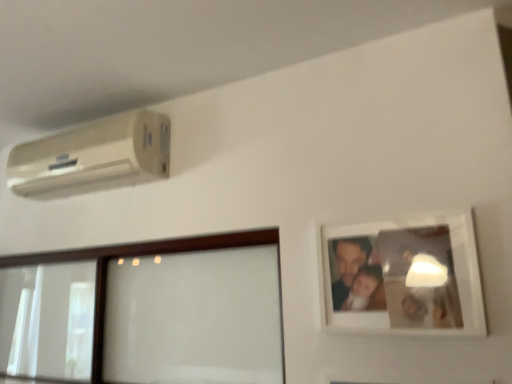
Question: Are white matte picture frame at upper right and white textured air conditioner at upper left located far from each other?

Choices:
 (A) no
 (B) yes

Answer: (A)

Question: Is white matte picture frame at upper right further to the viewer compared to white textured air conditioner at upper left?

Choices:
 (A) no
 (B) yes

Answer: (A)

Question: Considering the relative sizes of white matte picture frame at upper right and white textured air conditioner at upper left in the image provided, is white matte picture frame at upper right taller than white textured air conditioner at upper left?

Choices:
 (A) yes
 (B) no

Answer: (A)

Question: From the image's perspective, is white matte picture frame at upper right above white textured air conditioner at upper left?

Choices:
 (A) yes
 (B) no

Answer: (B)

Question: Is white textured air conditioner at upper left inside white matte picture frame at upper right?

Choices:
 (A) no
 (B) yes

Answer: (A)

Question: From the image's perspective, is white matte picture frame at upper right located beneath white textured air conditioner at upper left?

Choices:
 (A) no
 (B) yes

Answer: (B)

Question: Does white textured air conditioner at upper left have a greater width compared to white matte picture frame at upper right?

Choices:
 (A) yes
 (B) no

Answer: (A)

Question: From the image's perspective, is white textured air conditioner at upper left above white matte picture frame at upper right?

Choices:
 (A) no
 (B) yes

Answer: (B)

Question: Is white matte picture frame at upper right completely or partially inside white textured air conditioner at upper left?

Choices:
 (A) no
 (B) yes

Answer: (A)

Question: From a real-world perspective, does white textured air conditioner at upper left stand above white matte picture frame at upper right?

Choices:
 (A) yes
 (B) no

Answer: (A)

Question: From the image's perspective, is white textured air conditioner at upper left located beneath white matte picture frame at upper right?

Choices:
 (A) yes
 (B) no

Answer: (B)

Question: Is white textured air conditioner at upper left smaller than white matte picture frame at upper right?

Choices:
 (A) no
 (B) yes

Answer: (A)

Question: Would you say white textured air conditioner at upper left is inside or outside white matte picture frame at upper right?

Choices:
 (A) inside
 (B) outside

Answer: (B)